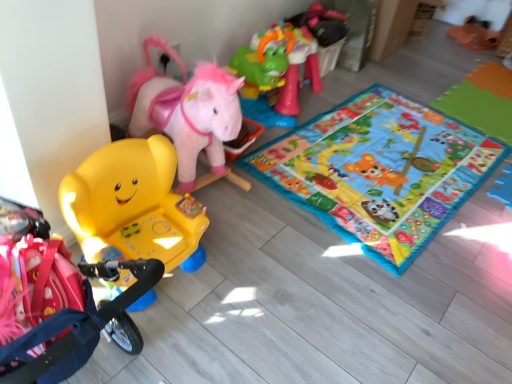
Question: Would you say multicolored fabric playmat at center is to the left or to the right of matte yellow plastic chair at left, arranged as the second toy when viewed from the top, in the picture?

Choices:
 (A) left
 (B) right

Answer: (B)

Question: From the image's perspective, relative to matte yellow plastic chair at left, marked as the first toy in a left-to-right arrangement, is multicolored fabric playmat at center above or below?

Choices:
 (A) below
 (B) above

Answer: (B)

Question: Which object is positioned farthest from the green plastic horse at upper right, the 1th toy positioned from the right?

Choices:
 (A) multicolored fabric playmat at center
 (B) matte yellow plastic chair at left, positioned as the first toy in front-to-back order

Answer: (B)

Question: Considering the real-world distances, which object is closest to the matte yellow plastic chair at left, marked as the first toy in a left-to-right arrangement?

Choices:
 (A) green plastic horse at upper right, the 2th toy from the front
 (B) multicolored fabric playmat at center

Answer: (B)